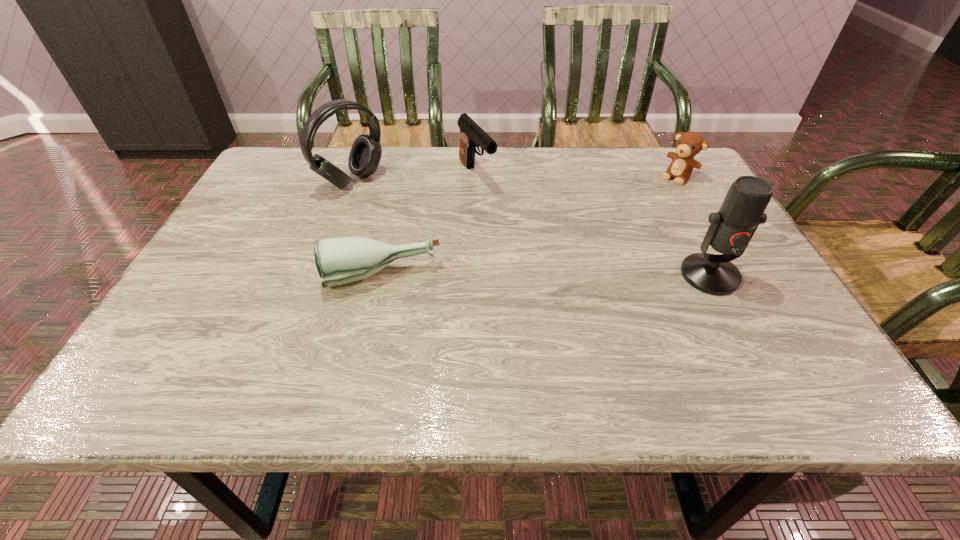
Where is `blank area in the image that satisfies the following two spatial constraints: 1. on the front side of the headset; 2. on the left side of the shortest object`? The height and width of the screenshot is (540, 960). blank area in the image that satisfies the following two spatial constraints: 1. on the front side of the headset; 2. on the left side of the shortest object is located at coordinates (316, 276).